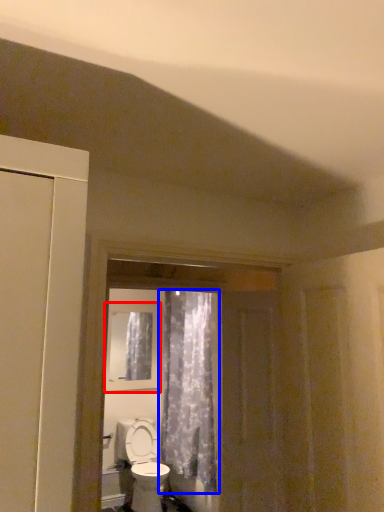
Question: Which object is closer to the camera taking this photo, window (highlighted by a red box) or curtain (highlighted by a blue box)?

Choices:
 (A) window
 (B) curtain

Answer: (B)